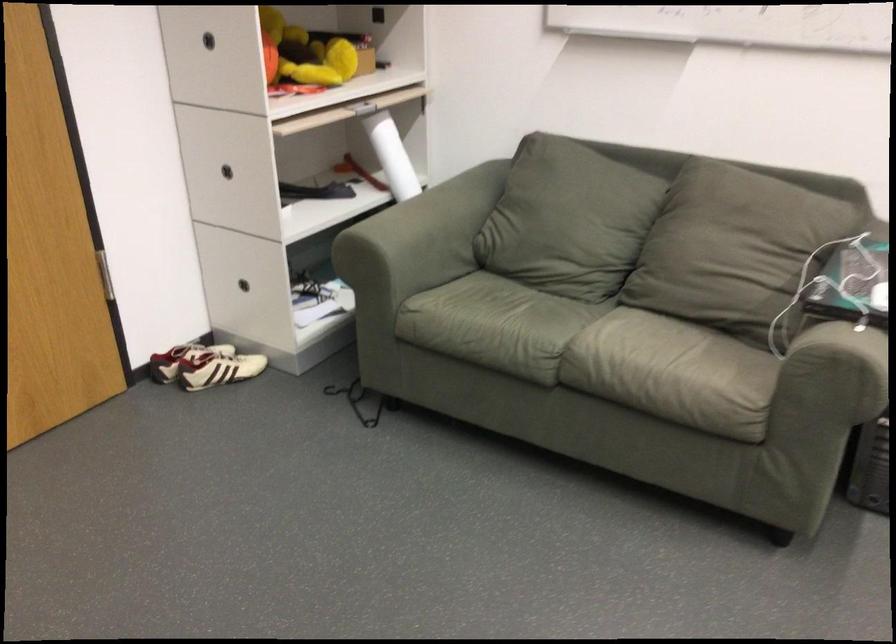
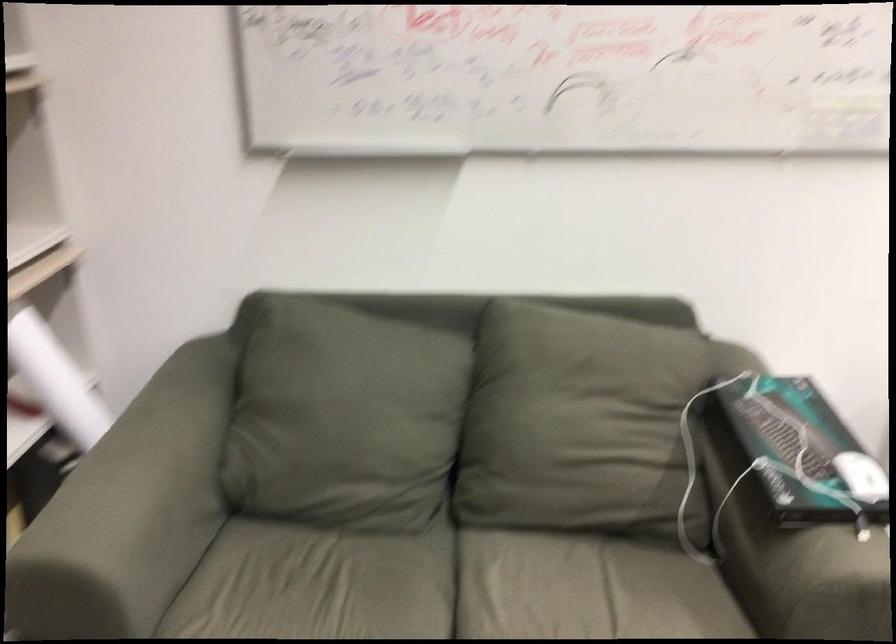
Question: In a continuous first-person perspective shot, in which direction is the camera moving?

Choices:
 (A) Left
 (B) Right
 (C) Forward
 (D) Backward

Answer: (C)